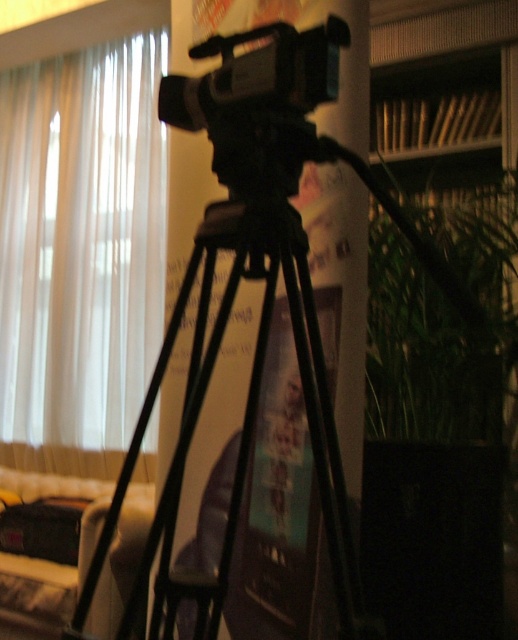
Question: Does green leafy plant at right appear on the left side of black plastic camera at center?

Choices:
 (A) no
 (B) yes

Answer: (A)

Question: Which of the following is the closest to the observer?

Choices:
 (A) white sheer curtain at left
 (B) black matte tripod at center

Answer: (B)

Question: Among these points, which one is nearest to the camera?

Choices:
 (A) [x=486, y=250]
 (B) [x=162, y=595]
 (C) [x=221, y=77]
 (D) [x=160, y=328]

Answer: (C)

Question: Does white sheer curtain at left appear on the left side of black matte tripod at center?

Choices:
 (A) no
 (B) yes

Answer: (B)

Question: Among these points, which one is farthest from the camera?

Choices:
 (A) pos(332,451)
 (B) pos(510,356)
 (C) pos(198,83)

Answer: (B)

Question: Is black matte tripod at center in front of green leafy plant at right?

Choices:
 (A) no
 (B) yes

Answer: (B)